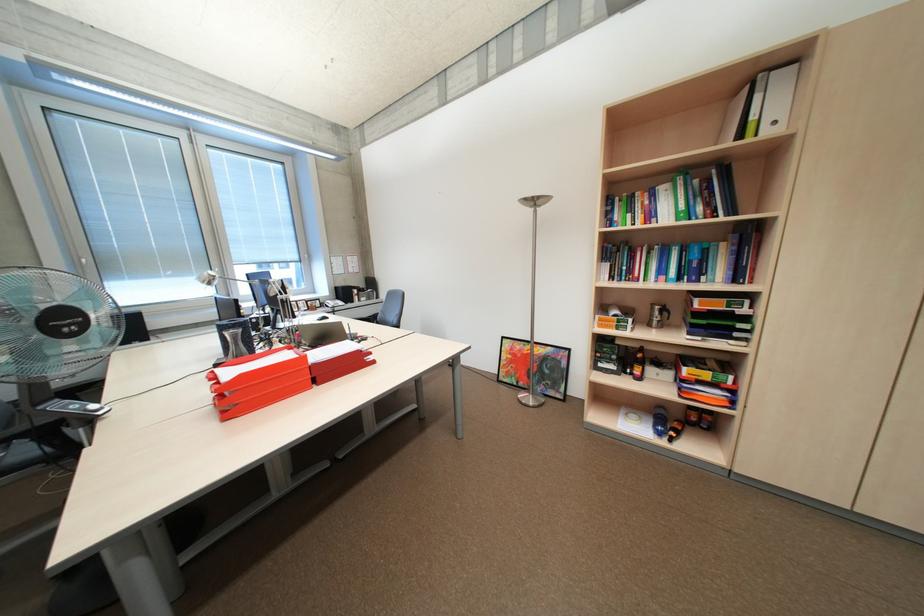
Image resolution: width=924 pixels, height=616 pixels. Describe the element at coordinates (658, 315) in the screenshot. I see `a glass carafe` at that location.